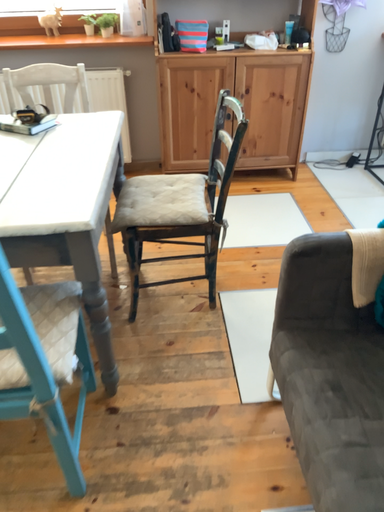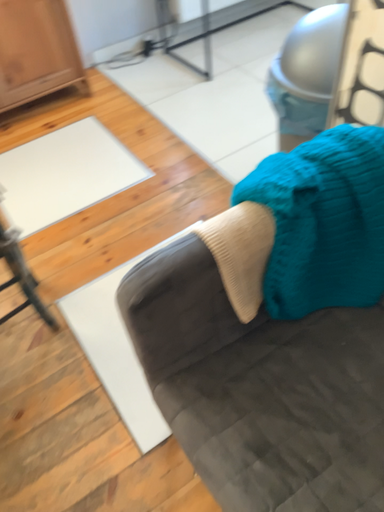
Question: How did the camera likely rotate when shooting the video?

Choices:
 (A) rotated downward
 (B) rotated upward

Answer: (A)